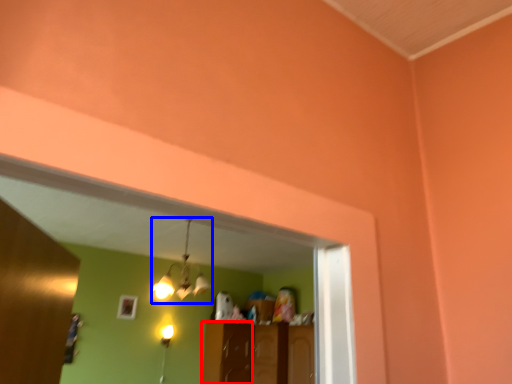
Question: Which of the following is the farthest to the observer, cabinetry (highlighted by a red box) or light fixture (highlighted by a blue box)?

Choices:
 (A) cabinetry
 (B) light fixture

Answer: (A)